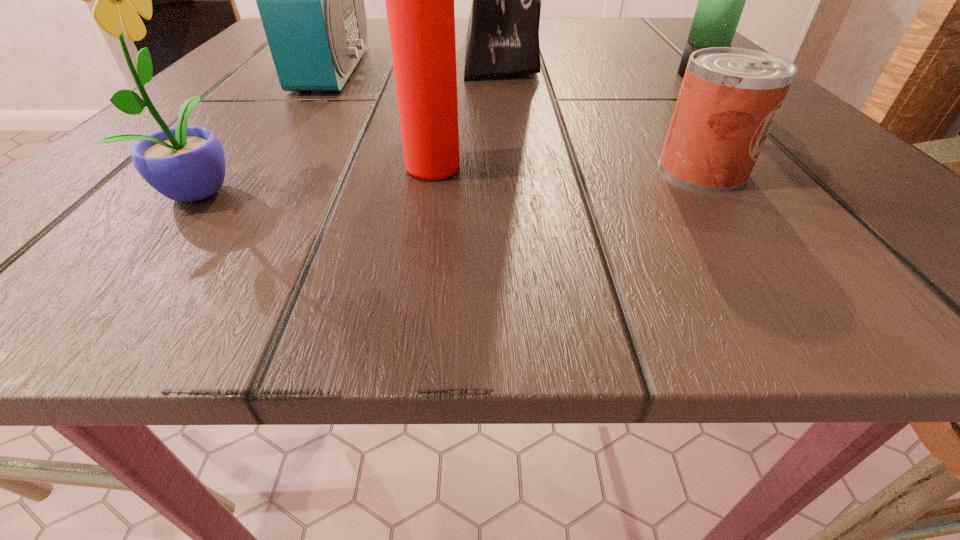
Where is `vacant space located on the front of the shopping bag with the design`? vacant space located on the front of the shopping bag with the design is located at coordinates (324, 52).

Identify the location of vacant space situated on the front panel of the second tallest object. (537, 69).

The image size is (960, 540). I want to click on free location located on the left of the right thermos bottle, so click(x=606, y=75).

The width and height of the screenshot is (960, 540). I want to click on free space located on the left of the left thermos bottle, so click(329, 168).

In order to click on free space located 0.060m on the front-facing side of the sunflower in this screenshot , I will do `click(300, 190)`.

The image size is (960, 540). I want to click on blank space located on the back of the second object from right to left, so click(x=635, y=77).

Find the location of `shopping bag present at the far edge`. shopping bag present at the far edge is located at coordinates (503, 31).

Locate an element on the screen. radio receiver located at the far edge is located at coordinates (311, 0).

Find the location of a particular element. radio receiver located in the left edge section of the desktop is located at coordinates (311, 0).

The image size is (960, 540). In order to click on sunflower positioned at the left edge in this screenshot , I will do `click(185, 163)`.